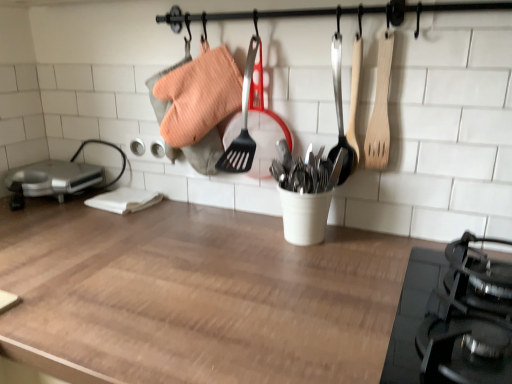
Where is `wooden spoon at upper right`? The height and width of the screenshot is (384, 512). wooden spoon at upper right is located at coordinates (340, 113).

This screenshot has height=384, width=512. What do you see at coordinates (340, 113) in the screenshot?
I see `wooden spoon at upper right` at bounding box center [340, 113].

The height and width of the screenshot is (384, 512). What do you see at coordinates (380, 108) in the screenshot?
I see `wooden spatula at upper right` at bounding box center [380, 108].

Find the location of a particular element. The width and height of the screenshot is (512, 384). metallic silver appliance at left is located at coordinates (50, 180).

The width and height of the screenshot is (512, 384). In order to click on wooden at center in this screenshot , I will do `click(195, 296)`.

Considering the positions of objects wooden spoon at upper right and wooden spatula at upper right in the image provided, who is more to the right, wooden spoon at upper right or wooden spatula at upper right?

wooden spatula at upper right.

In the scene shown: Is wooden spatula at upper right inside wooden spoon at upper right?

No, wooden spatula at upper right is not surrounded by wooden spoon at upper right.

From their relative heights in the image, would you say wooden spoon at upper right is taller or shorter than wooden spatula at upper right?

In the image, wooden spoon at upper right appears to be taller than wooden spatula at upper right.

Is wooden at center closer to camera compared to wooden spatula at upper right?

Yes, the depth of wooden at center is less than that of wooden spatula at upper right.

In the scene shown: From a real-world perspective, which object stands above the other?

wooden spatula at upper right.

Considering the sizes of objects wooden at center and wooden spatula at upper right in the image provided, who is taller, wooden at center or wooden spatula at upper right?

wooden at center is taller.

Is the surface of wooden spoon at upper right in direct contact with metallic silver appliance at left?

No, wooden spoon at upper right is not beside metallic silver appliance at left.

From the picture: From their relative heights in the image, would you say wooden spoon at upper right is taller or shorter than metallic silver appliance at left?

Considering their sizes, wooden spoon at upper right has more height than metallic silver appliance at left.

Considering the sizes of wooden spoon at upper right and metallic silver appliance at left in the image, is wooden spoon at upper right bigger or smaller than metallic silver appliance at left?

In the image, wooden spoon at upper right appears to be smaller than metallic silver appliance at left.

Considering the sizes of objects wooden spoon at upper right and metallic silver appliance at left in the image provided, who is thinner, wooden spoon at upper right or metallic silver appliance at left?

With smaller width is wooden spoon at upper right.

From a real-world perspective, is metallic silver appliance at left positioned above or below wooden at center?

metallic silver appliance at left is above wooden at center.

From the image's perspective, is metallic silver appliance at left above or below wooden at center?

metallic silver appliance at left is above wooden at center.

Can you confirm if metallic silver appliance at left is wider than wooden at center?

In fact, metallic silver appliance at left might be narrower than wooden at center.

Which of these two, metallic silver appliance at left or wooden at center, stands taller?

wooden at center is taller.

Where is `countertop beneath the wooden spoon at upper right (from a real-world perspective)`? This screenshot has width=512, height=384. countertop beneath the wooden spoon at upper right (from a real-world perspective) is located at coordinates (195, 296).

Which of these two, wooden at center or wooden spoon at upper right, stands shorter?

With less height is wooden spoon at upper right.

Considering the positions of point (222, 342) and point (355, 159), is point (222, 342) closer or farther from the camera than point (355, 159)?

Clearly, point (222, 342) is closer to the camera than point (355, 159).

Is wooden at center in front of wooden spoon at upper right?

Yes, wooden at center is closer to the viewer.

From a real-world perspective, between metallic silver appliance at left and wooden spatula at upper right, who is vertically lower?

metallic silver appliance at left.

Is metallic silver appliance at left located outside wooden spatula at upper right?

Yes, metallic silver appliance at left is not within wooden spatula at upper right.

Is metallic silver appliance at left not close to wooden spatula at upper right?

No, metallic silver appliance at left is not far away from wooden spatula at upper right.

Considering the positions of objects wooden at center and metallic silver appliance at left in the image provided, who is behind, wooden at center or metallic silver appliance at left?

metallic silver appliance at left is more distant.

Which of these two, wooden at center or metallic silver appliance at left, stands taller?

With more height is wooden at center.

What's the angular difference between wooden at center and metallic silver appliance at left's facing directions?

The angular difference between wooden at center and metallic silver appliance at left is 0.742 degrees.

Can you confirm if wooden at center is wider than metallic silver appliance at left?

Correct, the width of wooden at center exceeds that of metallic silver appliance at left.

This screenshot has height=384, width=512. What are the coordinates of `utensil behind the wooden spatula at upper right` in the screenshot? It's located at (340, 113).

Find the location of a particular element. This screenshot has width=512, height=384. countertop located below the wooden spatula at upper right (from the image's perspective) is located at coordinates (195, 296).

Looking at this image, from the image, which object appears to be nearer to wooden spoon at upper right, wooden spatula at upper right or metallic silver appliance at left?

Among the two, wooden spatula at upper right is located nearer to wooden spoon at upper right.

Based on their spatial positions, is wooden spoon at upper right or wooden at center further from wooden spatula at upper right?

wooden at center.

When comparing their distances from wooden spatula at upper right, does wooden spoon at upper right or metallic silver appliance at left seem further?

Among the two, metallic silver appliance at left is located further to wooden spatula at upper right.

Which object lies nearer to the anchor point metallic silver appliance at left, wooden spatula at upper right or wooden spoon at upper right?

wooden spoon at upper right is positioned closer to the anchor metallic silver appliance at left.

Which object lies further to the anchor point metallic silver appliance at left, wooden spoon at upper right or wooden at center?

The object further to metallic silver appliance at left is wooden spoon at upper right.

Looking at the image, which one is located closer to wooden spoon at upper right, wooden at center or metallic silver appliance at left?

The object closer to wooden spoon at upper right is wooden at center.

Based on their spatial positions, is metallic silver appliance at left or wooden at center closer to wooden spatula at upper right?

Based on the image, wooden at center appears to be nearer to wooden spatula at upper right.

Considering their positions, is wooden at center positioned further to wooden spoon at upper right than wooden spatula at upper right?

wooden at center lies further to wooden spoon at upper right than the other object.

Find the location of a particular element. The width and height of the screenshot is (512, 384). utensil between wooden spatula at upper right and wooden at center from top to bottom is located at coordinates [x=340, y=113].

Locate an element on the screen. This screenshot has height=384, width=512. countertop located between metallic silver appliance at left and wooden spatula at upper right in the left-right direction is located at coordinates (195, 296).

Locate an element on the screen. countertop between metallic silver appliance at left and wooden spoon at upper right is located at coordinates (195, 296).

The height and width of the screenshot is (384, 512). I want to click on utensil between metallic silver appliance at left and wooden spatula at upper right from left to right, so point(340,113).